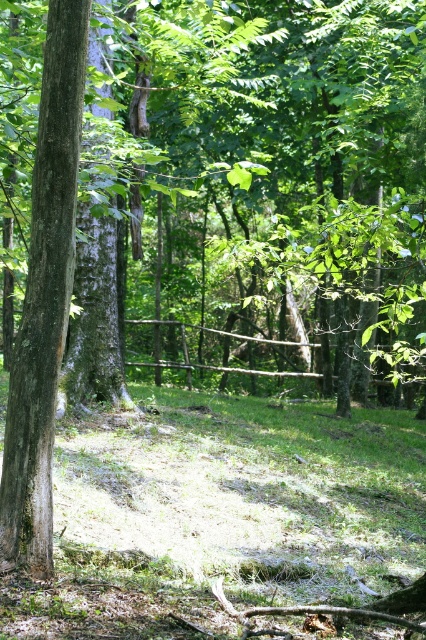
Question: Is smooth brown tree trunk at left positioned behind brown wooden fence at center?

Choices:
 (A) no
 (B) yes

Answer: (A)

Question: Does smooth brown tree trunk at left come behind brown wooden fence at center?

Choices:
 (A) no
 (B) yes

Answer: (A)

Question: Which of the following is the farthest from the observer?

Choices:
 (A) (62, 145)
 (B) (141, 364)

Answer: (B)

Question: Among these objects, which one is nearest to the camera?

Choices:
 (A) brown wooden fence at center
 (B) smooth brown tree trunk at left

Answer: (B)

Question: Can you confirm if smooth brown tree trunk at left is positioned above brown wooden fence at center?

Choices:
 (A) no
 (B) yes

Answer: (B)

Question: Which of the following is the farthest from the observer?

Choices:
 (A) smooth brown tree trunk at left
 (B) brown wooden fence at center

Answer: (B)